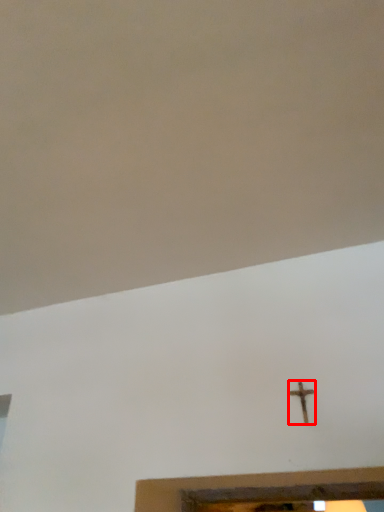
Question: From the image's perspective, where is nail (annotated by the red box) located relative to backdrop?

Choices:
 (A) below
 (B) above

Answer: (A)